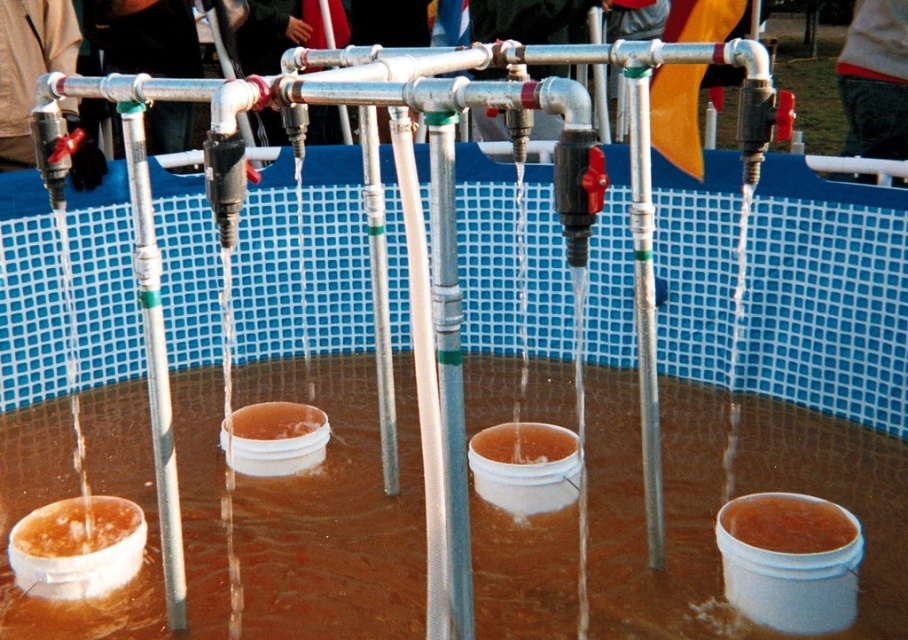
You are an engineer observing the setup. You need to adjust the flow of the translucent orange liquid at center so it doesn not spill over the brown matte bucket at center. Based on their positions, which direction should you direct the liquid flow?

The translucent orange liquid at center is positioned on the right side of the brown matte bucket at center. To prevent spilling, you should direct the liquid flow to the left side of the brown matte bucket at center.

You are standing in front of the pipe setup and want to reach both the point at coordinates point (28, 536) and the point at coordinates point (324, 417). Which point should you approach first to minimize the distance walked?

You should approach point (28, 536) first because it is closer to you than point (324, 417).

You are a scientist observing the experiment setup. You notice the translucent orange liquid at center and the brown matte bucket at center. Which object takes up more space in the image?

The translucent orange liquid at center takes up more space than the brown matte bucket at center because it is bigger.